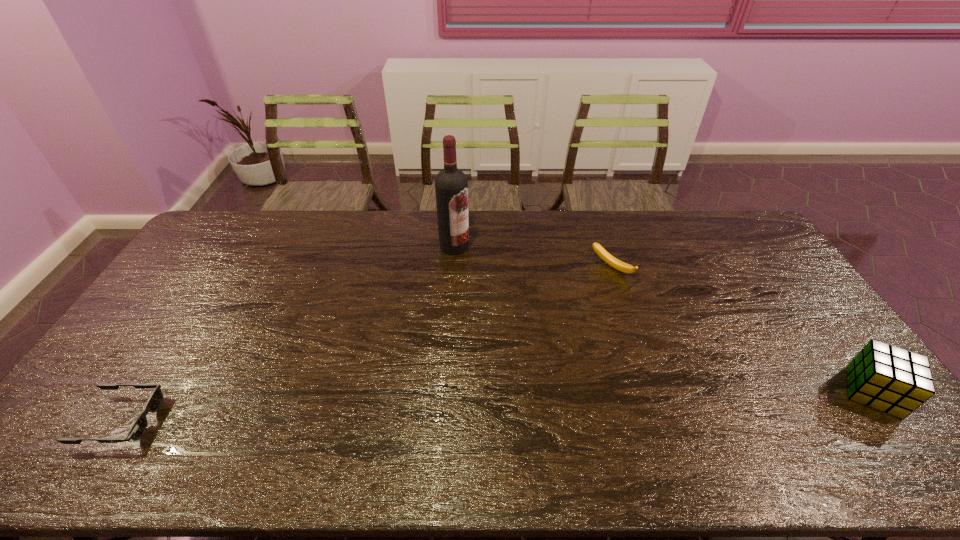
This screenshot has width=960, height=540. In order to click on vacant space that's between the third object from right to left and the sunglasses in this screenshot , I will do `click(288, 333)`.

Identify the location of unoccupied area between the wine bottle and the cube. The height and width of the screenshot is (540, 960). (664, 319).

I want to click on vacant space in between the third object from left to right and the cube, so click(742, 330).

Find the location of `empty space that is in between the shortest object and the cube`. empty space that is in between the shortest object and the cube is located at coordinates (497, 406).

This screenshot has width=960, height=540. Identify the location of free space between the tallest object and the sunglasses. (288, 333).

Identify the location of free area in between the third object from left to right and the second object from left to right. (533, 257).

Locate an element on the screen. This screenshot has height=540, width=960. free space between the third shortest object and the leftmost object is located at coordinates (497, 406).

The image size is (960, 540). Find the location of `vacant area that lies between the rightmost object and the shortest object`. vacant area that lies between the rightmost object and the shortest object is located at coordinates (497, 406).

Identify which object is the second closest to the rightmost object. Please provide its 2D coordinates. Your answer should be formatted as a tuple, i.e. [(x, y)], where the tuple contains the x and y coordinates of a point satisfying the conditions above.

[(451, 186)]

Locate an element on the screen. the third closest object relative to the third shortest object is located at coordinates (139, 427).